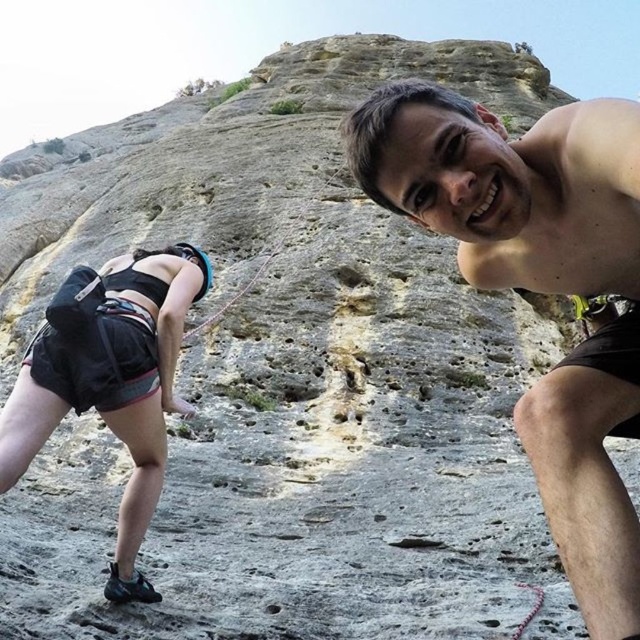
Question: Which is farther from the black fabric shorts at lower left?

Choices:
 (A) shiny black shorts at center
 (B) rope at center

Answer: (B)

Question: Can you confirm if shiny black shorts at center is wider than rope at center?

Choices:
 (A) yes
 (B) no

Answer: (A)

Question: Which point appears farthest from the camera in this image?

Choices:
 (A) (509, 196)
 (B) (268, 262)
 (C) (52, 381)

Answer: (B)

Question: Which is farther from the shiny black shorts at center?

Choices:
 (A) black fabric shorts at lower left
 (B) rope at center

Answer: (B)

Question: Is shiny black shorts at center in front of black fabric shorts at lower left?

Choices:
 (A) yes
 (B) no

Answer: (A)

Question: Does black fabric shorts at lower left appear on the left side of rope at center?

Choices:
 (A) yes
 (B) no

Answer: (A)